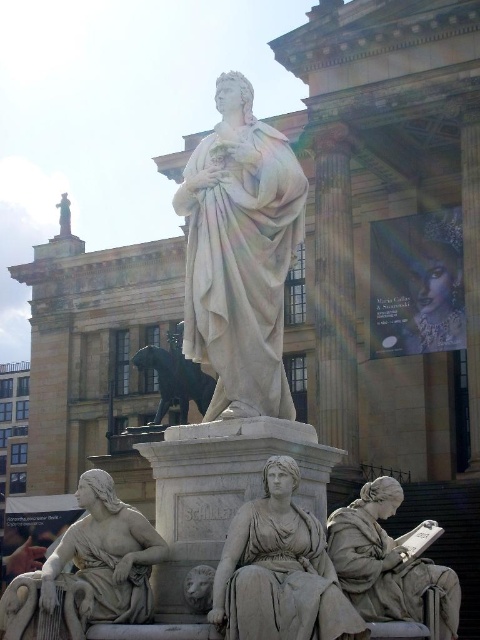
Which is in front, point (204, 317) or point (163, 552)?

Point (163, 552) is more forward.

Does white marble statue at center have a greater height compared to matte white statue at lower left?

Correct, white marble statue at center is much taller as matte white statue at lower left.

What do you see at coordinates (240, 253) in the screenshot?
I see `white marble statue at center` at bounding box center [240, 253].

Find the location of `white marble statue at center`. white marble statue at center is located at coordinates (240, 253).

Can you confirm if matte gray statue at center is positioned above matte stone lion at lower center?

Yes.

The height and width of the screenshot is (640, 480). Find the location of `matte gray statue at center`. matte gray statue at center is located at coordinates (279, 570).

Between point (253, 371) and point (445, 620), which one is positioned in front?

Positioned in front is point (445, 620).

Identify the location of white marble statue at center. The image size is (480, 640). [x=240, y=253].